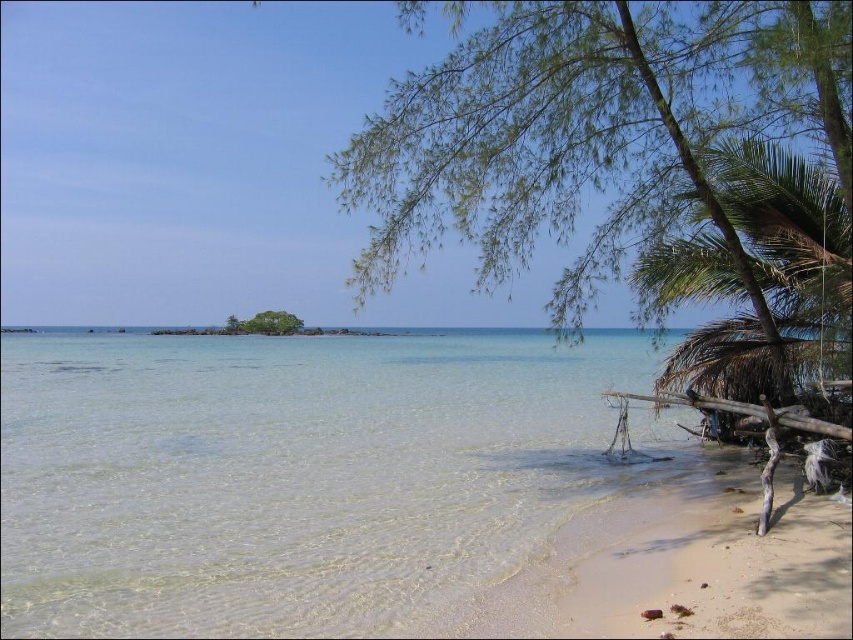
Between clear water at center and green leafy tree at center, which one is positioned higher?

green leafy tree at center

Does clear water at center have a greater width compared to green leafy tree at center?

Indeed, clear water at center has a greater width compared to green leafy tree at center.

Who is more distant from viewer, [437,604] or [265,324]?

Point [265,324]

Where is `clear water at center`? clear water at center is located at coordinates (297, 476).

Does clear water at center appear under green leafy tree at right?

Indeed, clear water at center is positioned under green leafy tree at right.

Which is in front, point (346, 522) or point (560, 225)?

Positioned in front is point (346, 522).

The width and height of the screenshot is (853, 640). What are the coordinates of `clear water at center` in the screenshot? It's located at (297, 476).

Is green leafy tree at right below green leafy tree at center?

No.

Does green leafy tree at right come behind green leafy tree at center?

No, it is not.

This screenshot has height=640, width=853. Find the location of `green leafy tree at right`. green leafy tree at right is located at coordinates (592, 134).